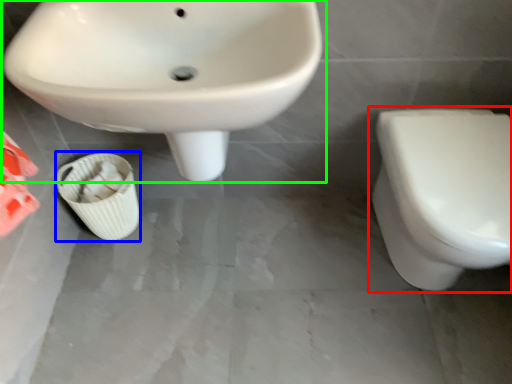
Question: Which object is the closest to the toilet (highlighted by a red box)? Choose among these: potty (highlighted by a blue box) or sink (highlighted by a green box).

Choices:
 (A) potty
 (B) sink

Answer: (B)